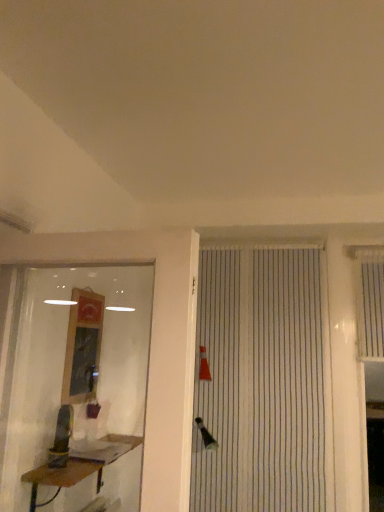
Question: Considering their positions, is transparent glass shop window at left located in front of or behind brown wooden table at lower left?

Choices:
 (A) behind
 (B) front

Answer: (B)

Question: Is point (59, 305) positioned closer to the camera than point (96, 441)?

Choices:
 (A) closer
 (B) farther

Answer: (A)

Question: Based on their relative distances, which object is nearer to the white striped shutter at right?

Choices:
 (A) brown wooden table at lower left
 (B) wooden framed mirror at left
 (C) transparent glass shop window at left
 (D) white striped window blind at center

Answer: (D)

Question: Estimate the real-world distances between objects in this image. Which object is closer to the white striped shutter at right?

Choices:
 (A) brown wooden table at lower left
 (B) transparent glass shop window at left
 (C) wooden framed mirror at left
 (D) white striped window blind at center

Answer: (D)